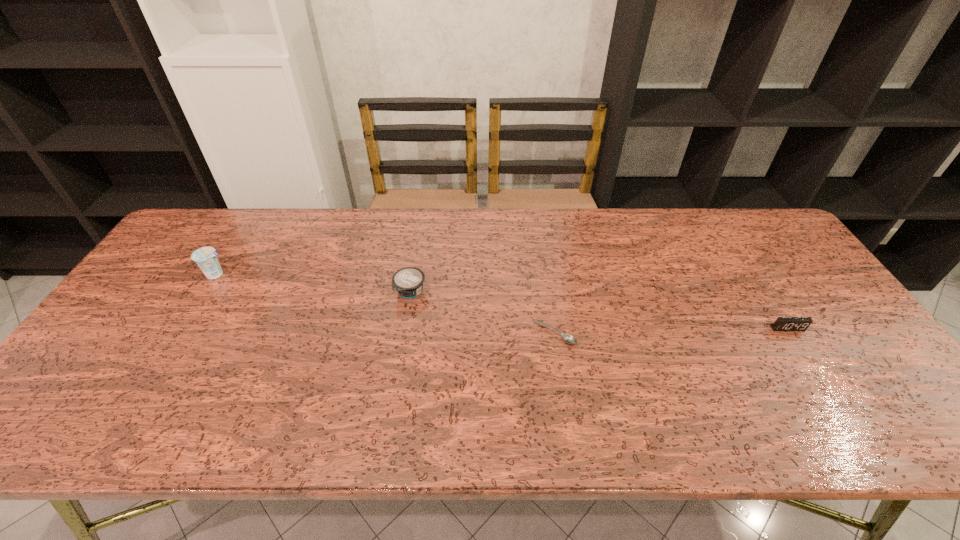
Identify the location of object that is the nearest to the shortest object. (408, 282).

The height and width of the screenshot is (540, 960). Find the location of `vacant space that satisfies the following two spatial constraints: 1. on the front side of the tallest object; 2. on the right side of the third object from right to left`. vacant space that satisfies the following two spatial constraints: 1. on the front side of the tallest object; 2. on the right side of the third object from right to left is located at coordinates (205, 292).

Identify the location of blank space that satisfies the following two spatial constraints: 1. on the front side of the third shortest object; 2. on the left side of the third object from left to right. (404, 333).

You are a GUI agent. You are given a task and a screenshot of the screen. Output one action in this format:
    pyautogui.click(x=<x>, y=<y>)
    Task: Click on the free location that satisfies the following two spatial constraints: 1. on the front side of the second object from right to left; 2. on the left side of the right yogurt
    The width and height of the screenshot is (960, 540).
    Given the screenshot: What is the action you would take?
    pyautogui.click(x=404, y=333)